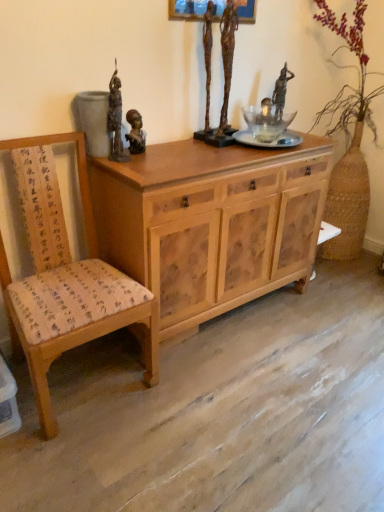
Find the location of a particular element. This screenshot has height=512, width=384. free space to the right of natural wood cabinet at center is located at coordinates (316, 322).